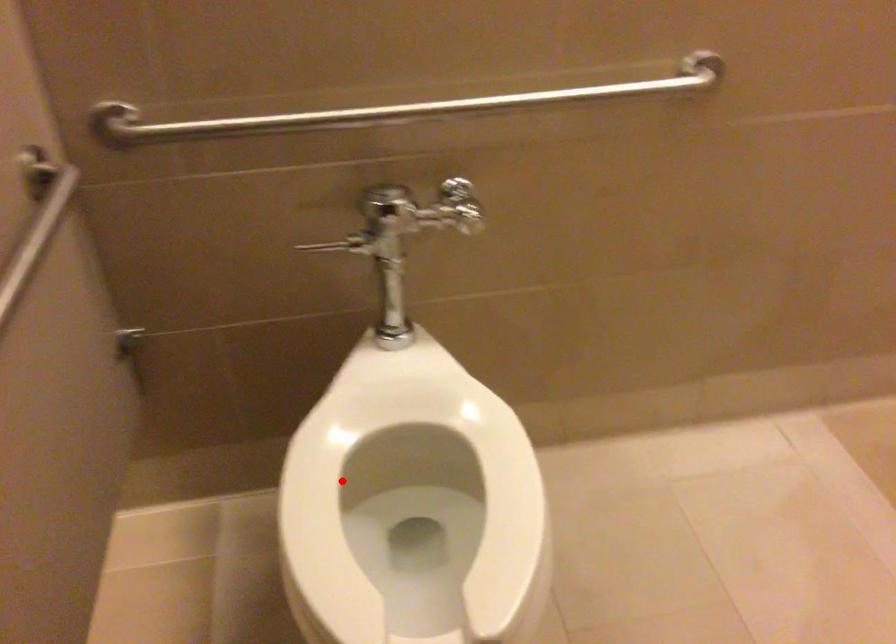
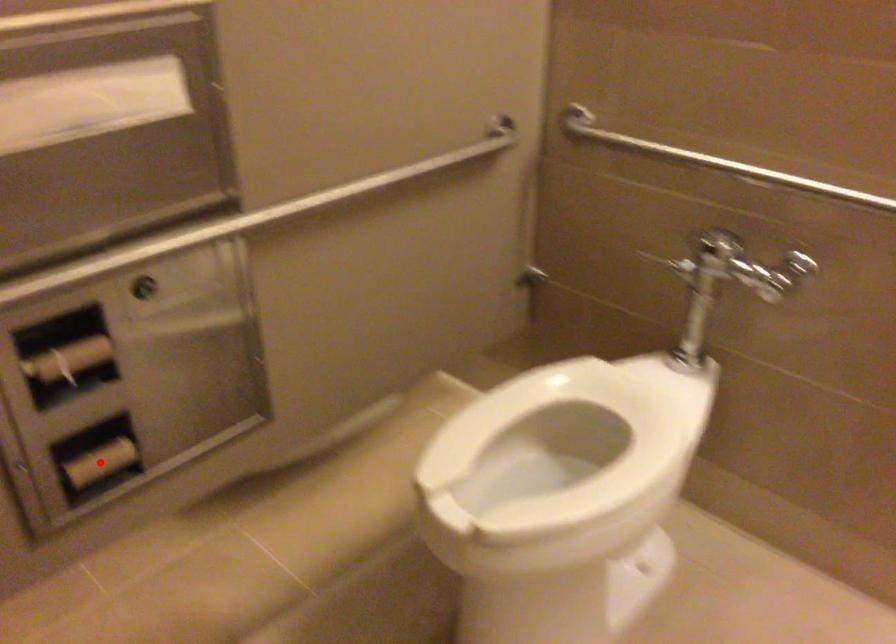
I am providing you with two images of the same scene from different viewpoints. A red point is marked on the first image and another point is marked on the second image. Does the point marked in image1 correspond to the same location as the one in image2?

No